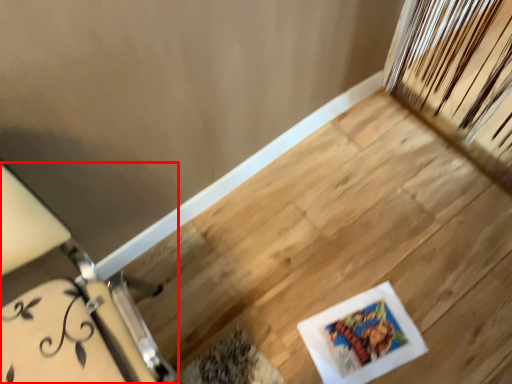
Question: From the image, what is the correct spatial relationship of furniture (annotated by the red box) in relation to picture frame?

Choices:
 (A) left
 (B) right

Answer: (A)